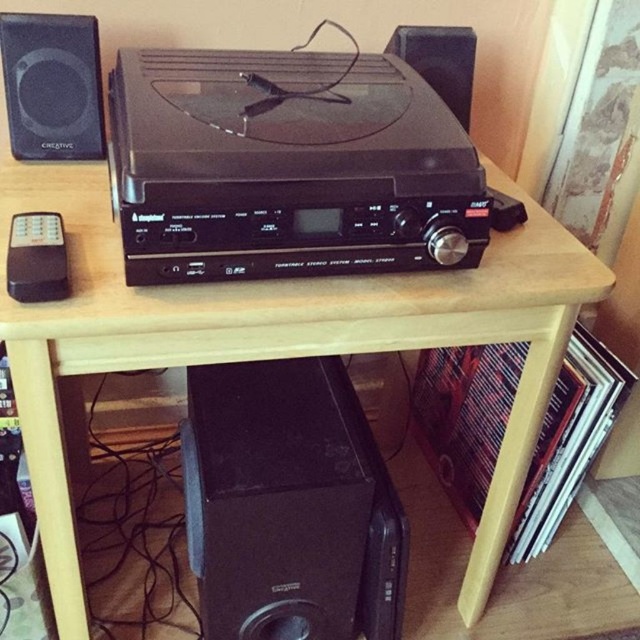
In the scene shown: You are setting up a new audio system and need to connect the black plastic stereo at center to the matte black speaker at upper left. Based on their positions in the image, which direction should you point the cable from the stereo to reach the speaker?

The black plastic stereo at center is below the matte black speaker at upper left, so you should point the cable upward from the stereo to reach the speaker.

You are setting up a new audio system and need to place a rectangular box that is 12 inches wide on the table. The table has limited space between the black plastic stereo at center and the matte black speaker at upper left. Can the box fit between them based on their sizes?

The black plastic stereo at center is wider than the matte black speaker at upper left. Since the box is 12 inches wide, but the exact distance between them isn

You are setting up a vintage audio system and need to place the black plastic stereo at center and the black matte speaker at upper center on a shelf. The shelf has limited height clearance. Based on the image, which object might not fit if the shelf is only 10 cm tall?

The black plastic stereo at center is much taller than the black matte speaker at upper center, so it might not fit on the shelf if the height clearance is only 10 cm.